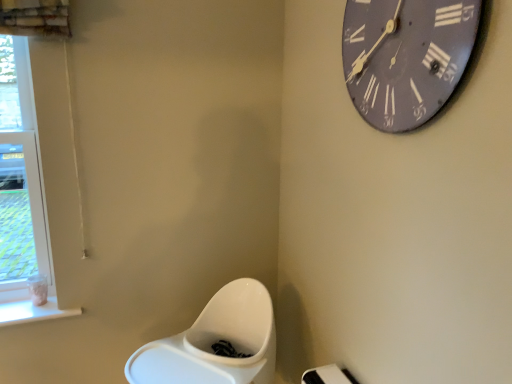
What are the coordinates of `clear glass window at left` in the screenshot? It's located at (23, 202).

The width and height of the screenshot is (512, 384). What do you see at coordinates (23, 202) in the screenshot? I see `clear glass window at left` at bounding box center [23, 202].

Measure the distance between point (1, 124) and camera.

A distance of 5.86 feet exists between point (1, 124) and camera.

Identify the location of matte gray clock at upper right. This screenshot has width=512, height=384. (406, 57).

Describe the element at coordinates (406, 57) in the screenshot. I see `matte gray clock at upper right` at that location.

The height and width of the screenshot is (384, 512). I want to click on clear glass window at left, so click(x=23, y=202).

Between clear glass window at left and matte gray clock at upper right, which one appears on the right side from the viewer's perspective?

matte gray clock at upper right is more to the right.

Relative to matte gray clock at upper right, is clear glass window at left in front or behind?

clear glass window at left is positioned farther from the viewer than matte gray clock at upper right.

Considering the points (26, 212) and (405, 4), which point is in front, point (26, 212) or point (405, 4)?

The point (405, 4) is closer to the camera.

From the image's perspective, would you say clear glass window at left is positioned over matte gray clock at upper right?

Actually, clear glass window at left appears below matte gray clock at upper right in the image.

From a real-world perspective, who is located higher, clear glass window at left or matte gray clock at upper right?

matte gray clock at upper right, from a real-world perspective.

Is clear glass window at left wider than matte gray clock at upper right?

Yes.

Is clear glass window at left shorter than matte gray clock at upper right?

Incorrect, the height of clear glass window at left does not fall short of that of matte gray clock at upper right.

Which of these two, clear glass window at left or matte gray clock at upper right, is bigger?

With larger size is clear glass window at left.

Is clear glass window at left situated inside matte gray clock at upper right or outside?

clear glass window at left is spatially situated outside matte gray clock at upper right.

Is clear glass window at left next to matte gray clock at upper right and touching it?

No, clear glass window at left is not beside matte gray clock at upper right.

Is clear glass window at left turned away from matte gray clock at upper right?

No, clear glass window at left is not facing the opposite direction of matte gray clock at upper right.

What's the angular difference between clear glass window at left and matte gray clock at upper right's facing directions?

They differ by 92 degrees in their facing directions.

How much distance is there between clear glass window at left and matte gray clock at upper right?

clear glass window at left is 4.25 feet away from matte gray clock at upper right.

This screenshot has width=512, height=384. I want to click on wall clock on the right of clear glass window at left, so click(406, 57).

Visually, is matte gray clock at upper right positioned to the left or to the right of clear glass window at left?

In the image, matte gray clock at upper right appears on the right side of clear glass window at left.

Which object is further away from the camera taking this photo, matte gray clock at upper right or clear glass window at left?

clear glass window at left is more distant.

Which is closer, (x=354, y=12) or (x=8, y=242)?

Point (x=354, y=12).

From the image's perspective, relative to clear glass window at left, is matte gray clock at upper right above or below?

Clearly, from the image's perspective, matte gray clock at upper right is above clear glass window at left.

From a real-world perspective, which object stands above the other?

matte gray clock at upper right, from a real-world perspective.

Is matte gray clock at upper right wider or thinner than clear glass window at left?

Considering their sizes, matte gray clock at upper right looks slimmer than clear glass window at left.

Which of these two, matte gray clock at upper right or clear glass window at left, stands shorter?

With less height is matte gray clock at upper right.

Based on the photo, in terms of size, does matte gray clock at upper right appear bigger or smaller than clear glass window at left?

In the image, matte gray clock at upper right appears to be smaller than clear glass window at left.

Would you say clear glass window at left is part of matte gray clock at upper right's contents?

No, clear glass window at left is not surrounded by matte gray clock at upper right.

Is matte gray clock at upper right touching clear glass window at left?

No, matte gray clock at upper right is not in contact with clear glass window at left.

Consider the image. Is matte gray clock at upper right looking in the opposite direction of clear glass window at left?

Answer: matte gray clock at upper right does not have its back to clear glass window at left.

Measure the distance between matte gray clock at upper right and clear glass window at left.

matte gray clock at upper right is 4.25 feet from clear glass window at left.

Find the location of a particular element. The image size is (512, 384). window lying below the matte gray clock at upper right (from the image's perspective) is located at coordinates (23, 202).

You are a GUI agent. You are given a task and a screenshot of the screen. Output one action in this format:
    pyautogui.click(x=<x>, y=<y>)
    Task: Click on the window below the matte gray clock at upper right (from a real-world perspective)
    The image size is (512, 384).
    Given the screenshot: What is the action you would take?
    pyautogui.click(x=23, y=202)

At what (x,y) coordinates should I click in order to perform the action: click on window below the matte gray clock at upper right (from the image's perspective). Please return your answer as a coordinate pair (x, y). This screenshot has width=512, height=384. Looking at the image, I should click on (23, 202).